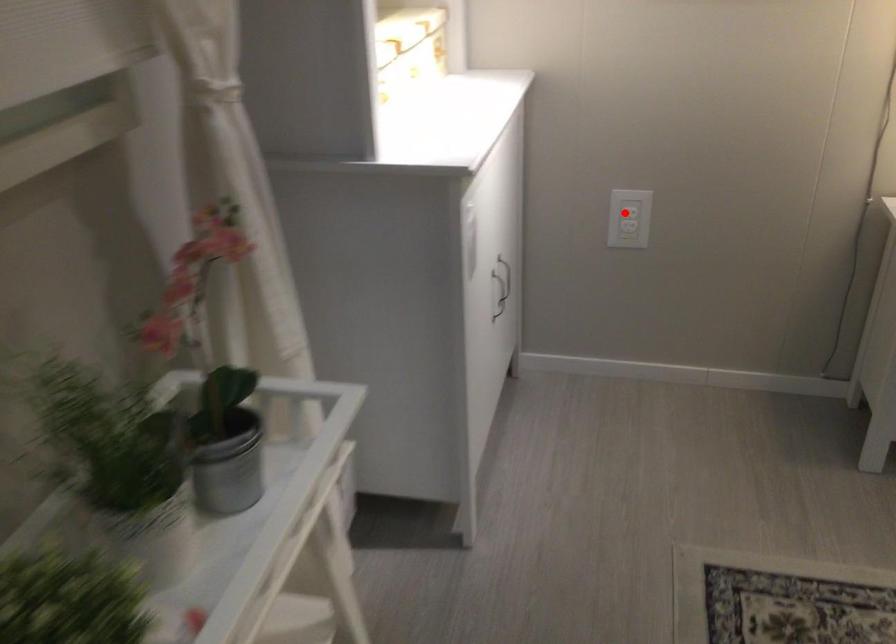
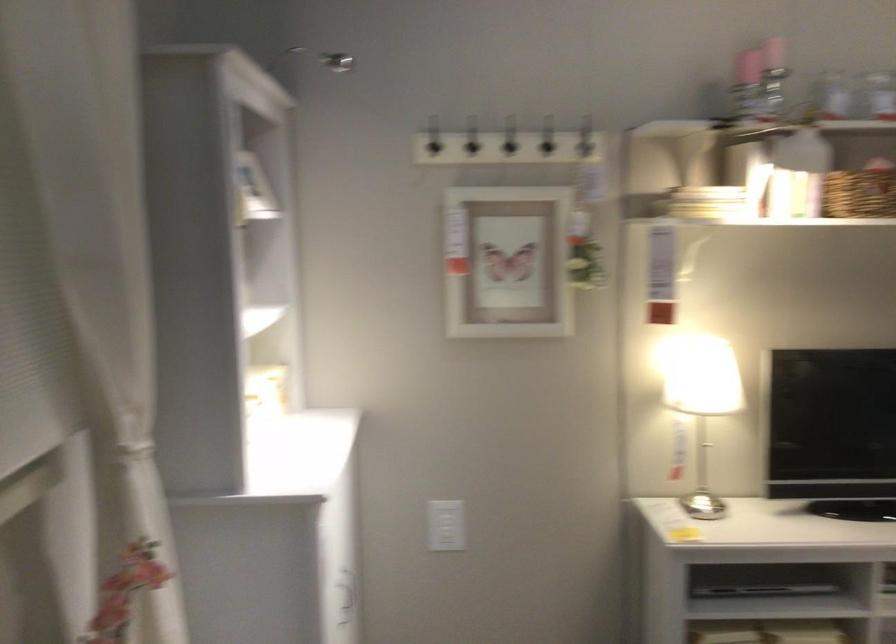
Question: I am providing you with two images of the same scene from different viewpoints. A red point is marked on the first image. Can you still see the location of the red point in image 2?

Choices:
 (A) Yes
 (B) No

Answer: (A)